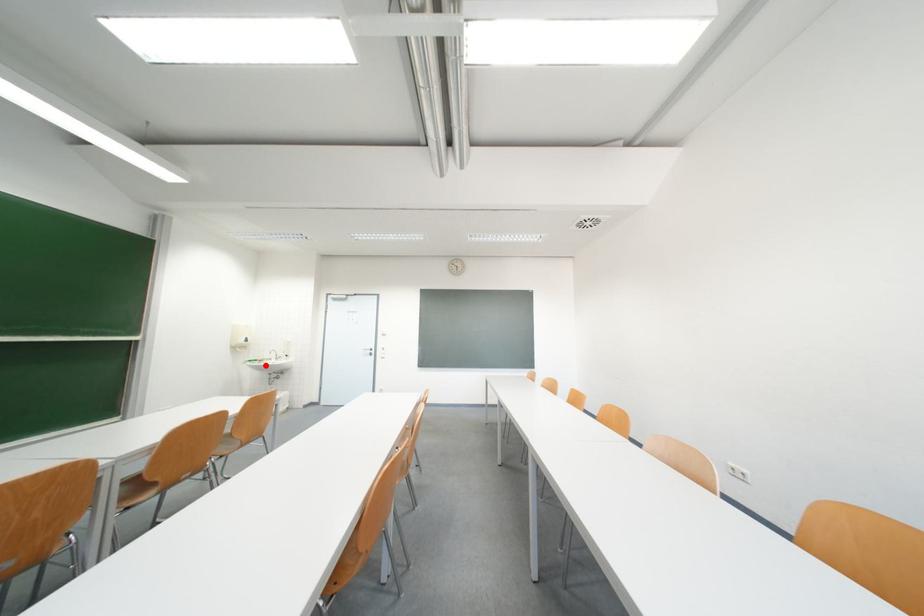
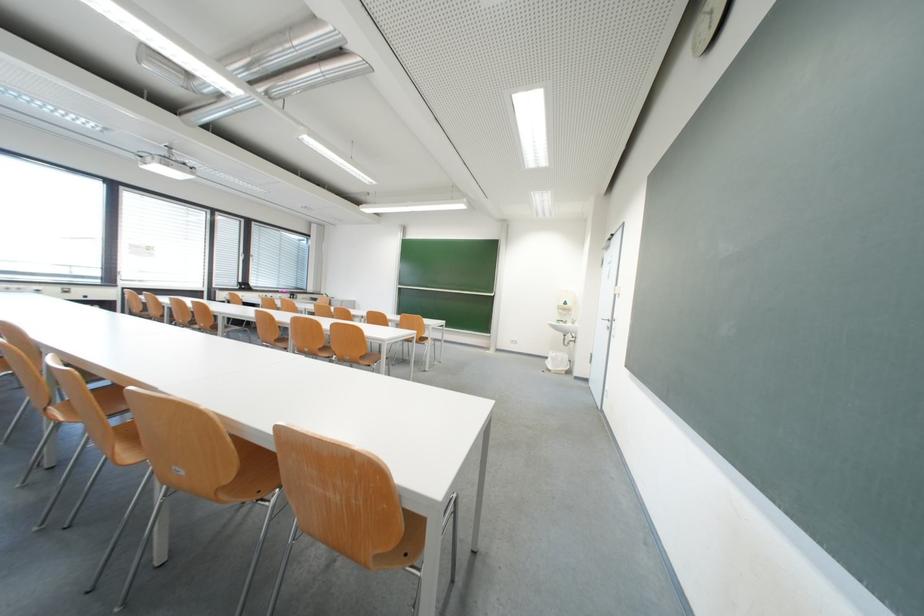
The point at the highlighted location is marked in the first image. Where is the corresponding point in the second image?

(570, 326)